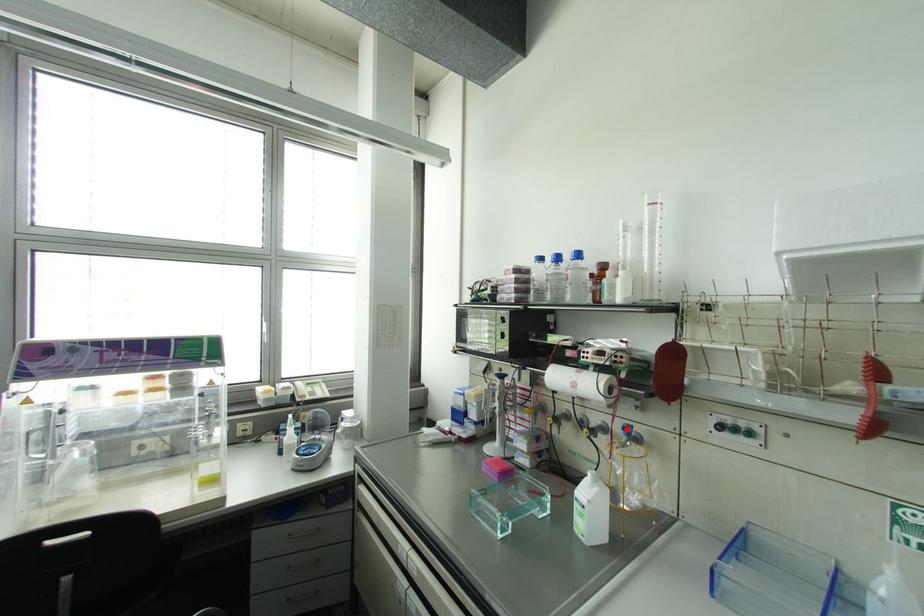
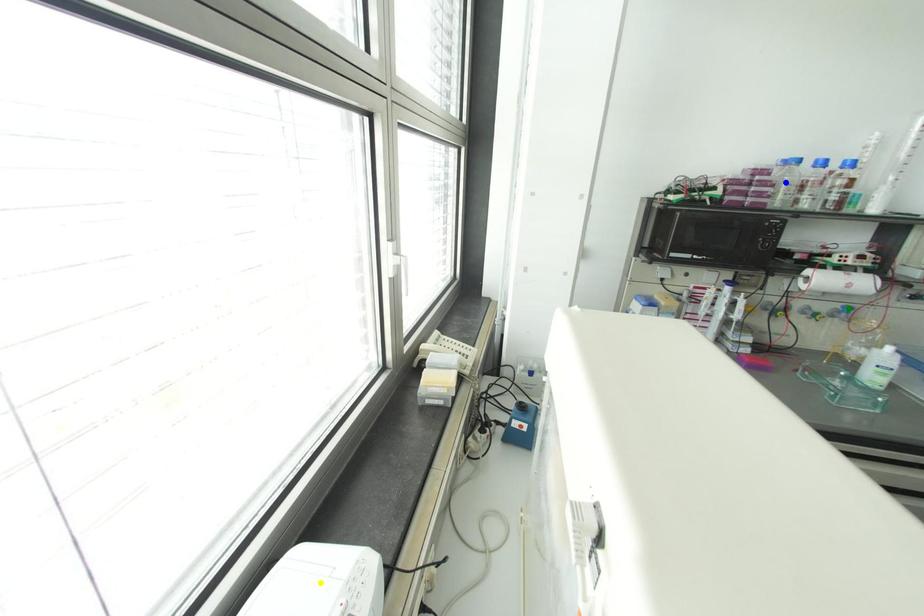
Question: I am providing you with two images of the same scene from different viewpoints. A red point is marked on the first image. You are given multiple points on the second image. Can you choose the point in image 2 that corresponds to the point in image 1?

Choices:
 (A) blue point
 (B) green point
 (C) yellow point

Answer: (B)